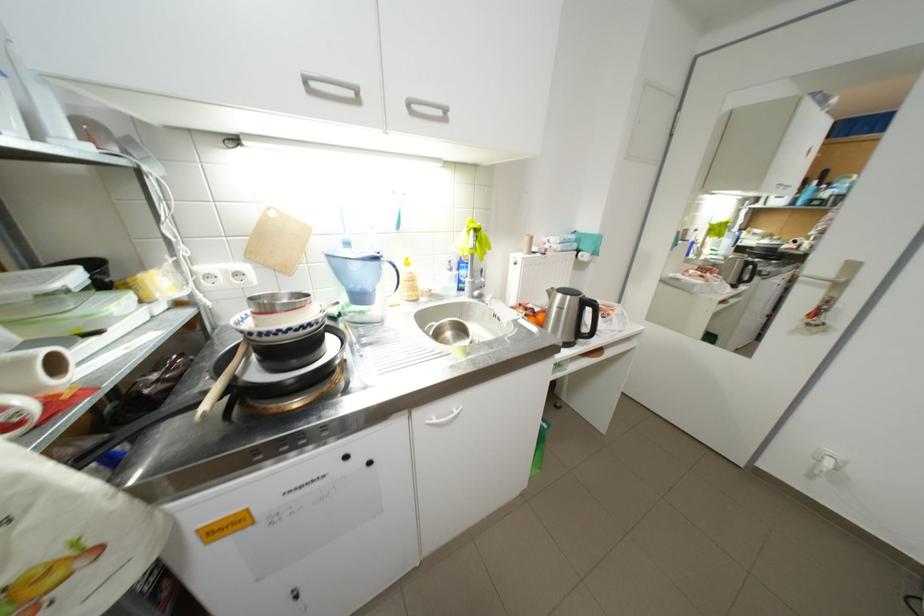
The height and width of the screenshot is (616, 924). What do you see at coordinates (473, 288) in the screenshot?
I see `the faucet handle` at bounding box center [473, 288].